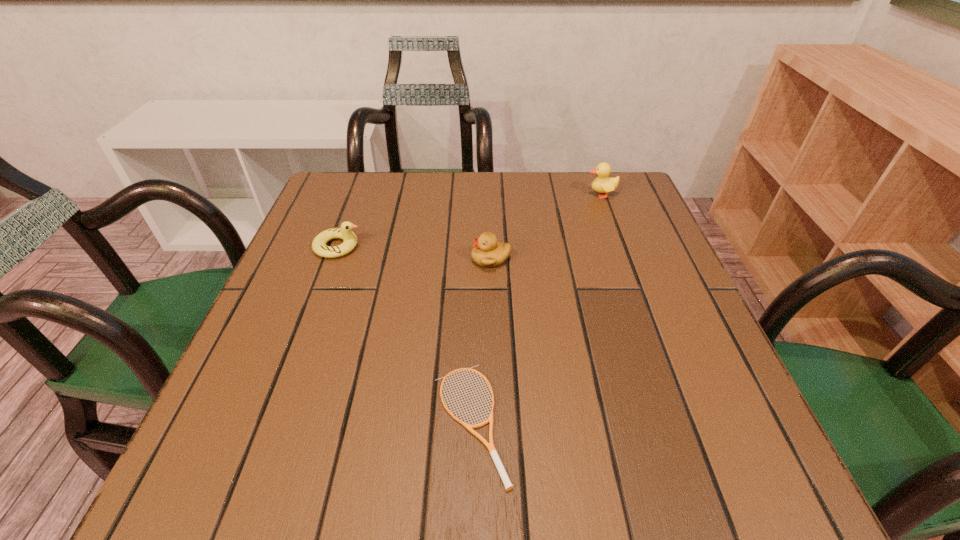
Image resolution: width=960 pixels, height=540 pixels. I want to click on free spot between the tallest object and the second duckling from left to right, so click(546, 227).

Locate an element on the screen. Image resolution: width=960 pixels, height=540 pixels. vacant point located between the leftmost object and the second duckling from left to right is located at coordinates (415, 253).

You are a GUI agent. You are given a task and a screenshot of the screen. Output one action in this format:
    pyautogui.click(x=<x>, y=<y>)
    Task: Click on the free space between the leftmost duckling and the nearest object
    The width and height of the screenshot is (960, 540).
    Given the screenshot: What is the action you would take?
    pyautogui.click(x=404, y=334)

Identify the location of free spot between the farthest duckling and the second duckling from right to left. (546, 227).

Locate an element on the screen. The image size is (960, 540). free space between the farthest duckling and the leftmost object is located at coordinates (469, 220).

I want to click on object that ranks as the second closest to the leftmost duckling, so click(x=490, y=446).

The width and height of the screenshot is (960, 540). I want to click on object that can be found as the closest to the nearest object, so click(487, 252).

What are the coordinates of `duckling identified as the closest to the leftmost object` in the screenshot? It's located at (487, 252).

Select which duckling is the closest to the tallest object. Please provide its 2D coordinates. Your answer should be formatted as a tuple, i.e. [(x, y)], where the tuple contains the x and y coordinates of a point satisfying the conditions above.

[(487, 252)]

At what (x,y) coordinates should I click in order to perform the action: click on vacant space that satisfies the following two spatial constraints: 1. on the face of the leftmost duckling; 2. on the back side of the nearest object. Please return your answer as a coordinate pair (x, y). Looking at the image, I should click on (273, 422).